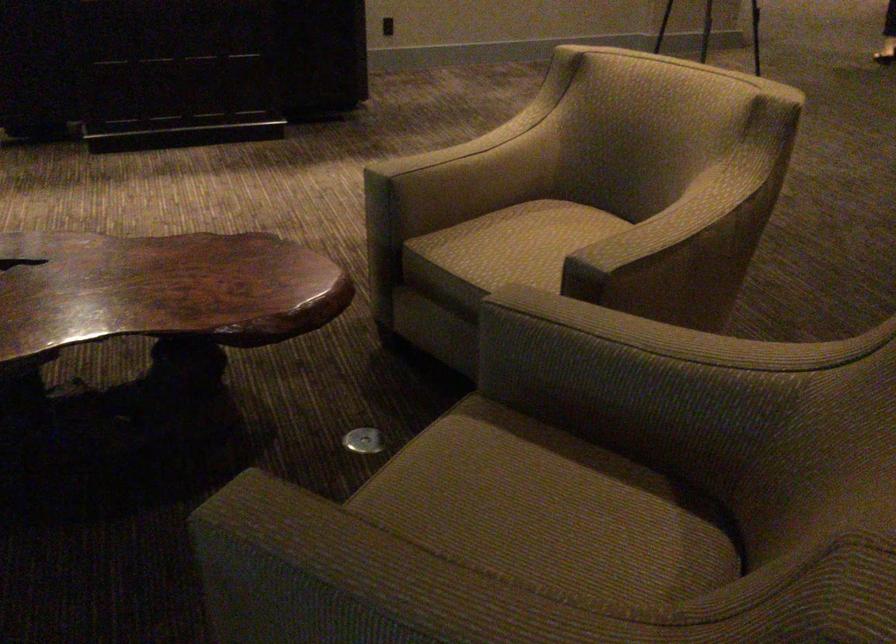
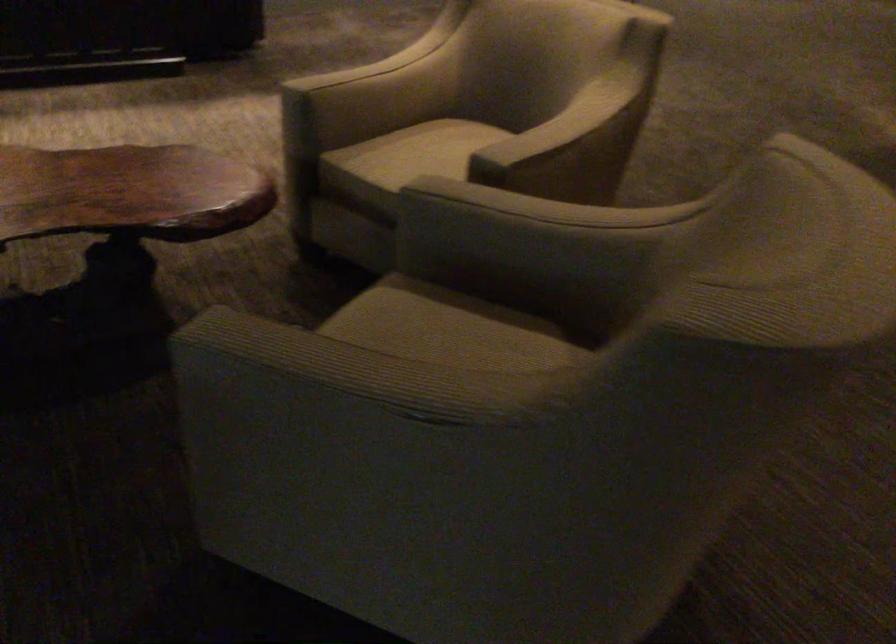
Question: The first image is from the beginning of the video and the second image is from the end. How did the camera likely rotate when shooting the video?

Choices:
 (A) Left
 (B) Right
 (C) Up
 (D) Down

Answer: (B)